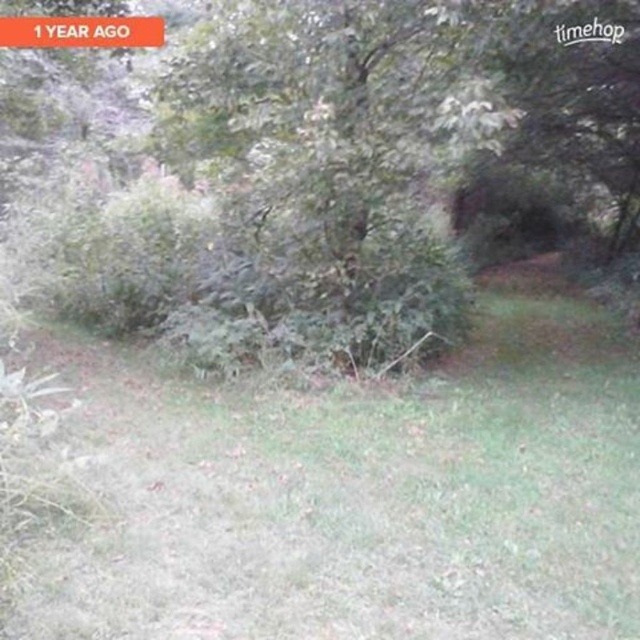
Question: From the image, what is the correct spatial relationship of green grass at center in relation to green leafy tree at center?

Choices:
 (A) left
 (B) right

Answer: (A)

Question: Is green grass at center thinner than green leafy tree at center?

Choices:
 (A) yes
 (B) no

Answer: (A)

Question: Does green grass at center have a greater width compared to green leafy tree at center?

Choices:
 (A) no
 (B) yes

Answer: (A)